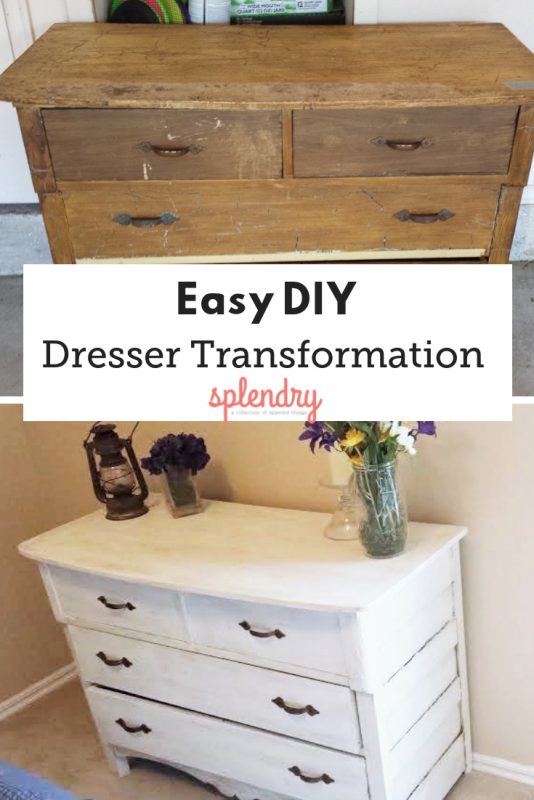
At what (x,y) coordinates should I click in order to perform the action: click on chest of drawers. Please return your answer as a coordinate pair (x, y). This screenshot has width=534, height=800. Looking at the image, I should click on (290, 210), (245, 588).